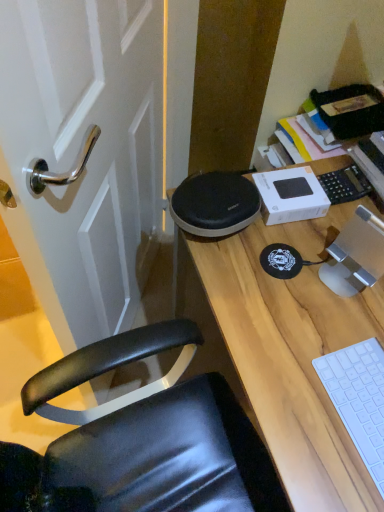
Question: Is wooden desk at center to the right of white plastic keyboard at lower right from the viewer's perspective?

Choices:
 (A) no
 (B) yes

Answer: (B)

Question: Is wooden desk at center positioned in front of white plastic keyboard at lower right?

Choices:
 (A) no
 (B) yes

Answer: (B)

Question: From a real-world perspective, is wooden desk at center over white plastic keyboard at lower right?

Choices:
 (A) no
 (B) yes

Answer: (A)

Question: Is wooden desk at center to the left of white plastic keyboard at lower right from the viewer's perspective?

Choices:
 (A) no
 (B) yes

Answer: (A)

Question: From a real-world perspective, is wooden desk at center below white plastic keyboard at lower right?

Choices:
 (A) yes
 (B) no

Answer: (A)

Question: Is the position of wooden desk at center more distant than that of white plastic keyboard at lower right?

Choices:
 (A) no
 (B) yes

Answer: (A)

Question: Does white plastic keyboard at lower right appear on the right side of wooden desk at center?

Choices:
 (A) yes
 (B) no

Answer: (B)

Question: Are white plastic keyboard at lower right and wooden desk at center far apart?

Choices:
 (A) yes
 (B) no

Answer: (B)

Question: Can you confirm if white plastic keyboard at lower right is thinner than wooden desk at center?

Choices:
 (A) no
 (B) yes

Answer: (B)

Question: Is white plastic keyboard at lower right beside wooden desk at center?

Choices:
 (A) yes
 (B) no

Answer: (B)

Question: Is white plastic keyboard at lower right not within wooden desk at center?

Choices:
 (A) yes
 (B) no

Answer: (B)

Question: From the image's perspective, is white plastic keyboard at lower right located above wooden desk at center?

Choices:
 (A) no
 (B) yes

Answer: (B)

Question: In terms of height, does white plastic keyboard at lower right look taller or shorter compared to wooden desk at center?

Choices:
 (A) tall
 (B) short

Answer: (B)